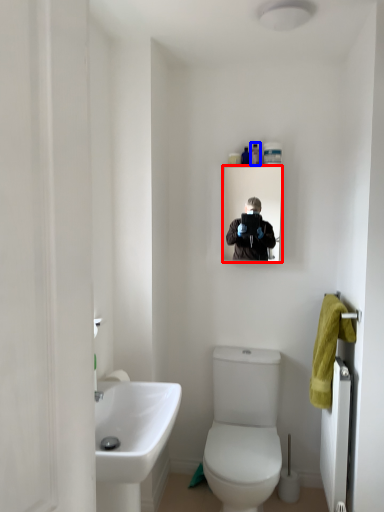
Question: Which object is further to the camera taking this photo, mirror (highlighted by a red box) or toiletry (highlighted by a blue box)?

Choices:
 (A) mirror
 (B) toiletry

Answer: (B)